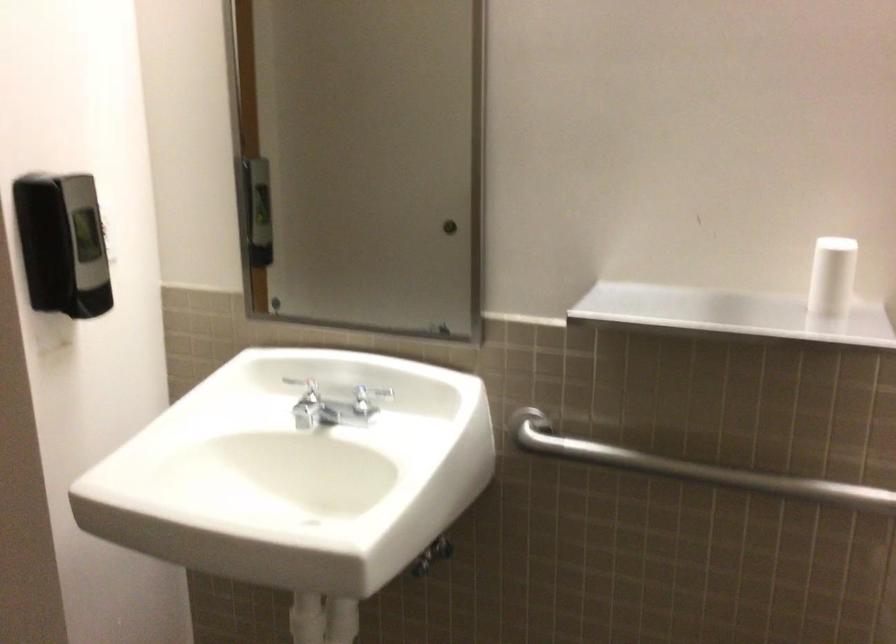
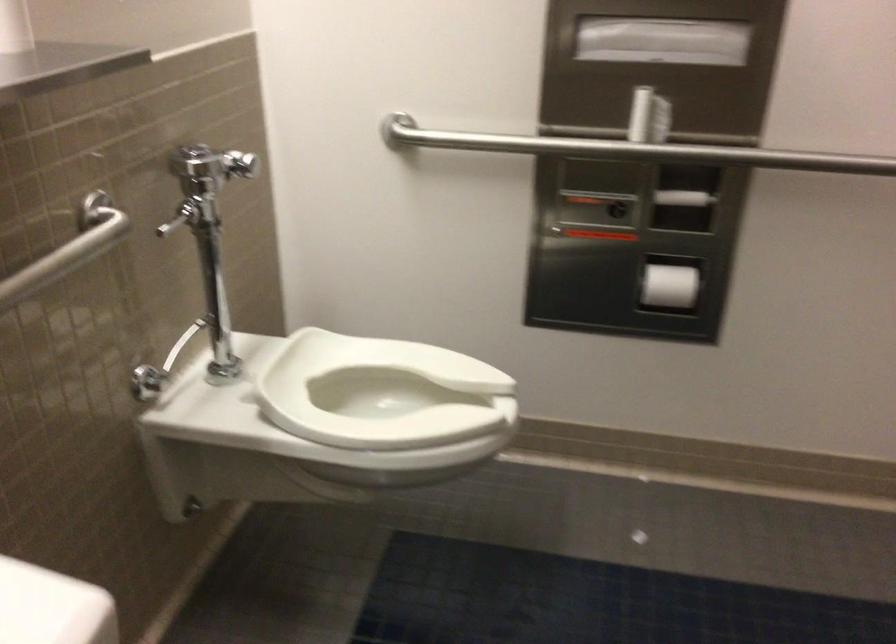
The point at (800, 469) is marked in the first image. Where is the corresponding point in the second image?

(67, 250)